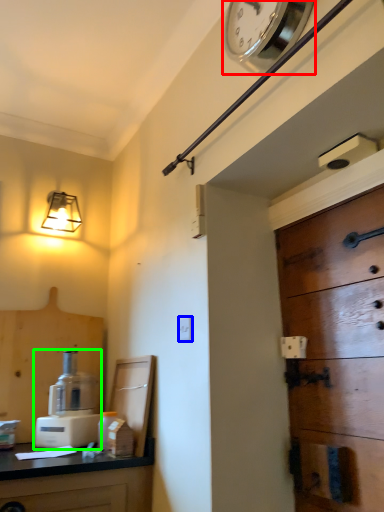
Question: Based on their relative distances, which object is nearer to clock (highlighted by a red box)? Choose from light switch (highlighted by a blue box) and coffee machine (highlighted by a green box).

Choices:
 (A) light switch
 (B) coffee machine

Answer: (A)